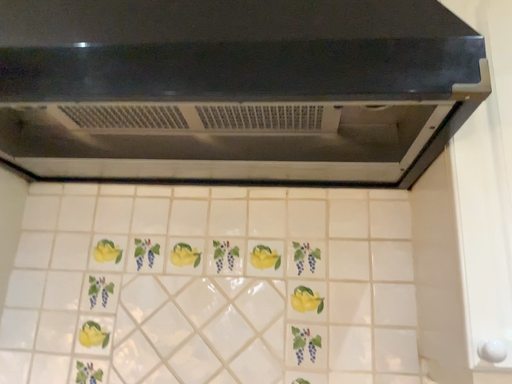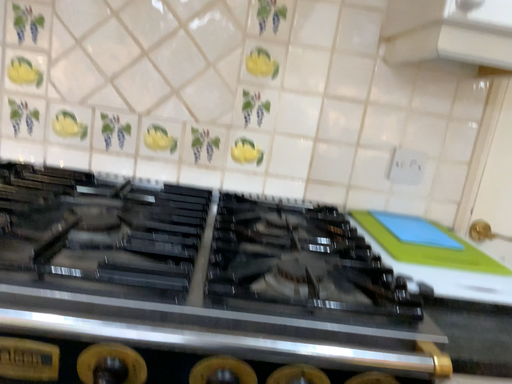
Question: Which way did the camera rotate in the video?

Choices:
 (A) rotated left
 (B) rotated right

Answer: (B)